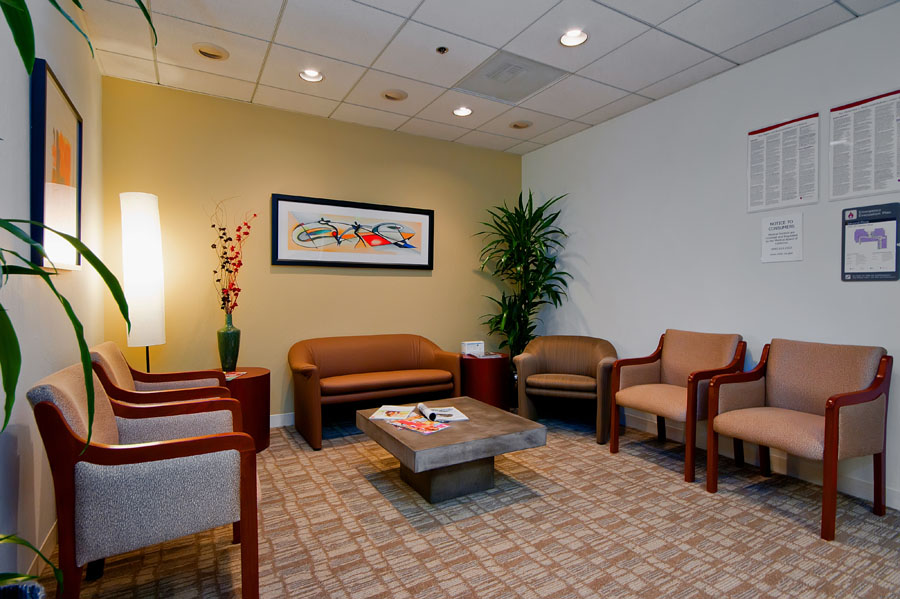
You are a GUI agent. You are given a task and a screenshot of the screen. Output one action in this format:
    pyautogui.click(x=<x>, y=<y>)
    Task: Click on the ceiling
    The height and width of the screenshot is (599, 900).
    Given the screenshot: What is the action you would take?
    pyautogui.click(x=403, y=41)